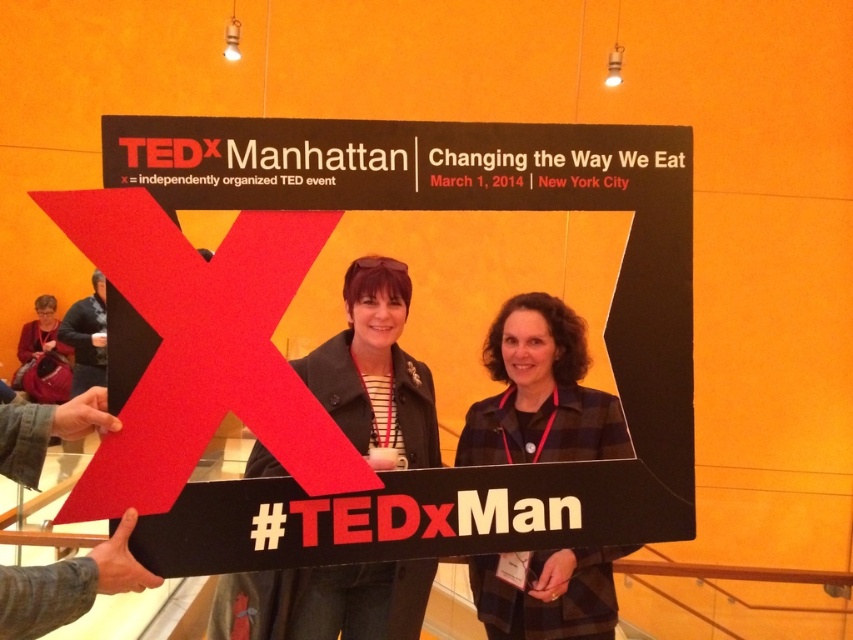
Is plaid fabric jacket at center closer to the viewer compared to matte black jacket at lower left?

Yes, it is in front of matte black jacket at lower left.

Measure the distance between plaid fabric jacket at center and camera.

The distance of plaid fabric jacket at center from camera is 2.14 meters.

Locate an element on the screen. plaid fabric jacket at center is located at coordinates (540, 392).

Who is lower down, matte black jacket at center or plaid fabric jacket at center?

plaid fabric jacket at center is lower down.

Is point (415, 406) less distant than point (608, 404)?

No, it is behind (608, 404).

The image size is (853, 640). I want to click on matte black jacket at center, so click(x=375, y=369).

Is matte black jacket at center below dark gray sweater at left?

Correct, matte black jacket at center is located below dark gray sweater at left.

Is matte black jacket at center wider than dark gray sweater at left?

In fact, matte black jacket at center might be narrower than dark gray sweater at left.

You are a GUI agent. You are given a task and a screenshot of the screen. Output one action in this format:
    pyautogui.click(x=<x>, y=<y>)
    Task: Click on the matte black jacket at center
    Image resolution: width=853 pixels, height=640 pixels.
    Given the screenshot: What is the action you would take?
    pyautogui.click(x=375, y=369)

Where is `matte black jacket at center`? The width and height of the screenshot is (853, 640). matte black jacket at center is located at coordinates (375, 369).